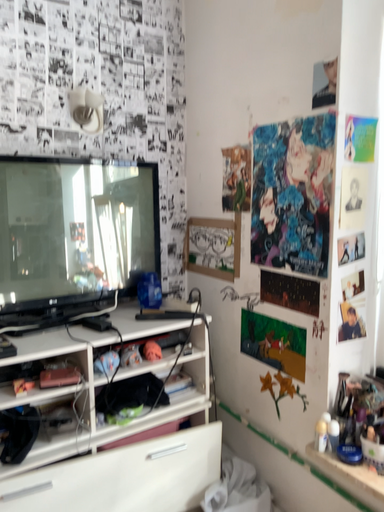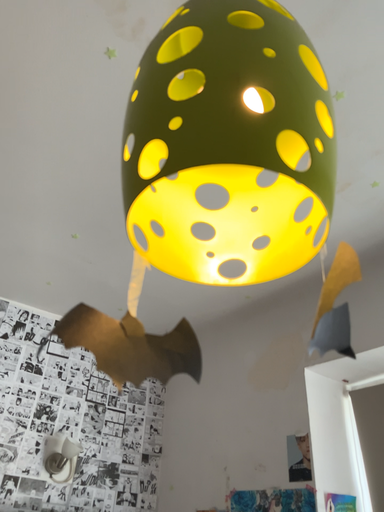
Question: How did the camera likely rotate when shooting the video?

Choices:
 (A) rotated downward
 (B) rotated upward

Answer: (B)